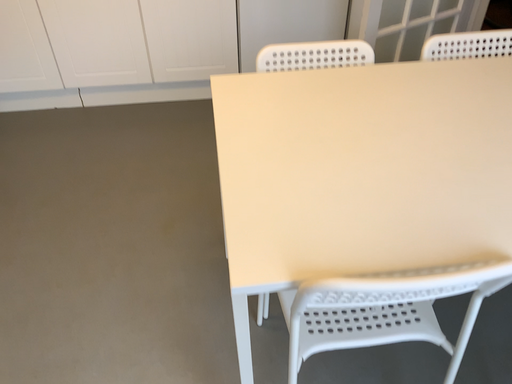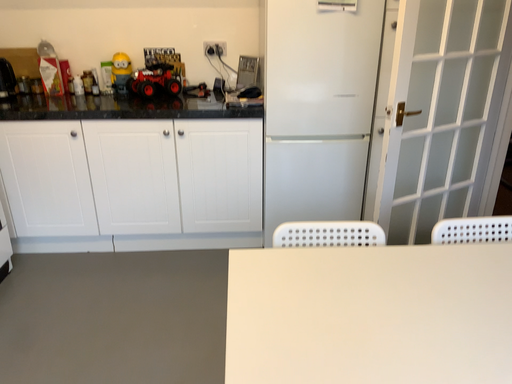
Question: How did the camera likely rotate when shooting the video?

Choices:
 (A) rotated upward
 (B) rotated downward

Answer: (A)